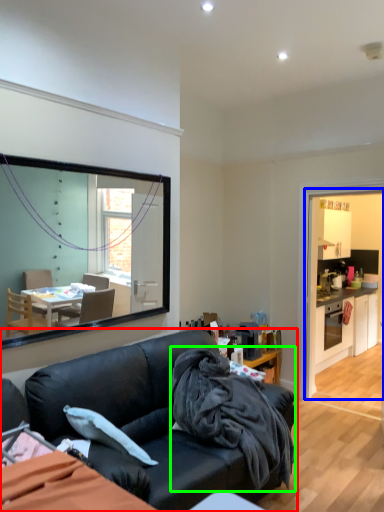
Question: Estimate the real-world distances between objects in this image. Which object is closer to studio couch (highlighted by a red box), dresser (highlighted by a blue box) or blanket (highlighted by a green box)?

Choices:
 (A) dresser
 (B) blanket

Answer: (B)